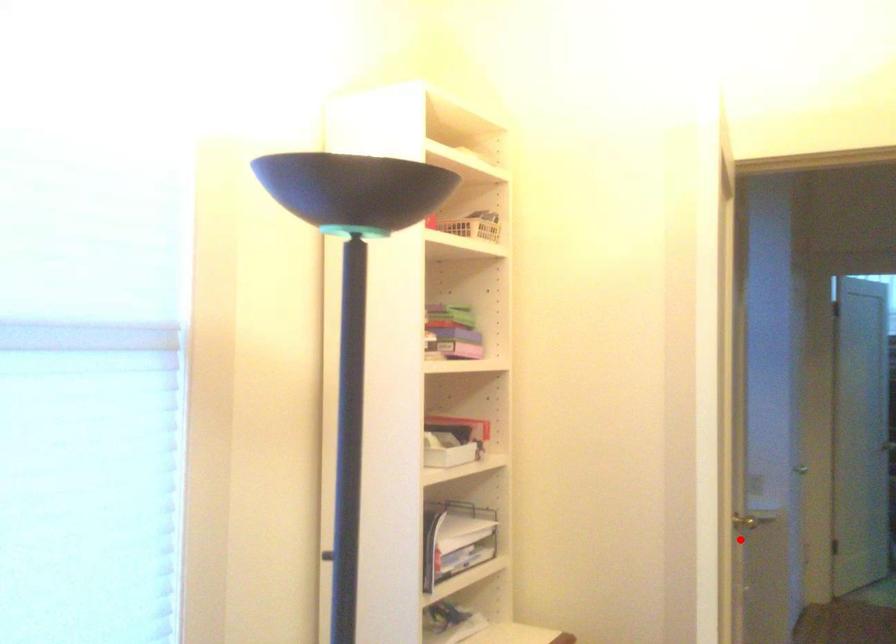
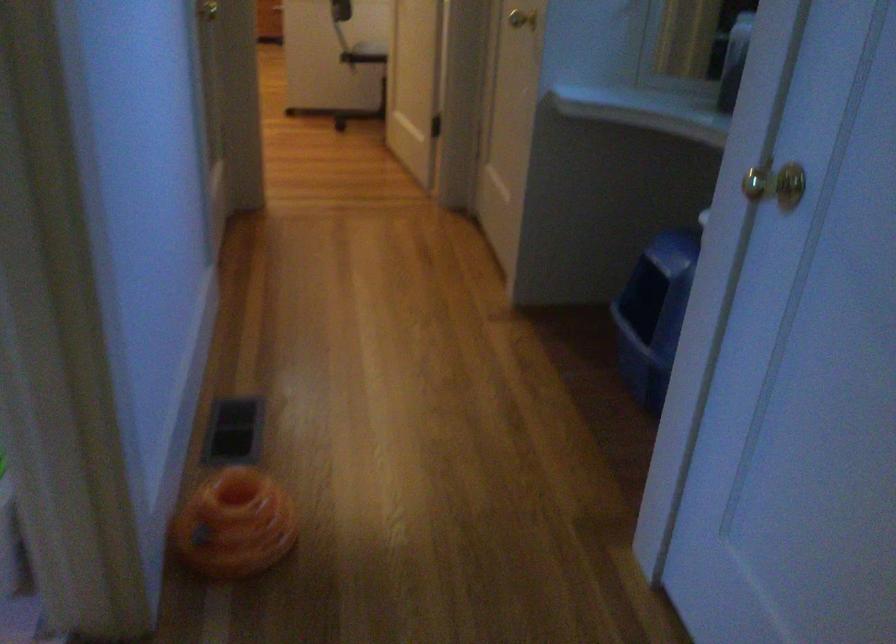
In the second image, find the point that corresponds to the highlighted location in the first image.

(521, 19)